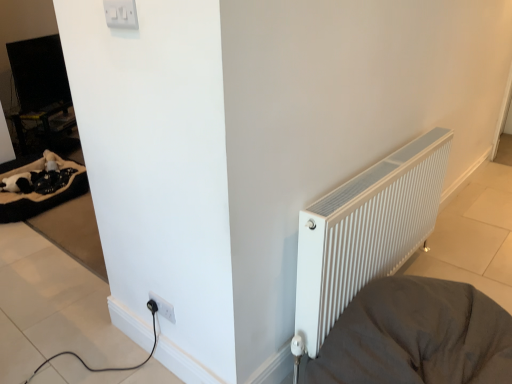
Question: From the image's perspective, is wooden table at left beneath white ribbed radiator at right?

Choices:
 (A) no
 (B) yes

Answer: (A)

Question: Could white ribbed radiator at right be considered to be inside wooden table at left?

Choices:
 (A) yes
 (B) no

Answer: (B)

Question: Is wooden table at left bigger than white ribbed radiator at right?

Choices:
 (A) no
 (B) yes

Answer: (A)

Question: Can you confirm if wooden table at left is wider than white ribbed radiator at right?

Choices:
 (A) yes
 (B) no

Answer: (A)

Question: Is wooden table at left aimed at white ribbed radiator at right?

Choices:
 (A) yes
 (B) no

Answer: (A)

Question: Is white ribbed radiator at right situated inside white ribbed radiator at right or outside?

Choices:
 (A) outside
 (B) inside

Answer: (A)

Question: In terms of width, does white ribbed radiator at right look wider or thinner when compared to white ribbed radiator at right?

Choices:
 (A) wide
 (B) thin

Answer: (A)

Question: Is point (410, 329) positioned closer to the camera than point (305, 235)?

Choices:
 (A) farther
 (B) closer

Answer: (A)

Question: In terms of size, does white ribbed radiator at right appear bigger or smaller than white ribbed radiator at right?

Choices:
 (A) big
 (B) small

Answer: (A)

Question: Considering their positions, is soft beige fabric at left located in front of or behind white ribbed radiator at right?

Choices:
 (A) front
 (B) behind

Answer: (B)

Question: From the image's perspective, is soft beige fabric at left located above or below white ribbed radiator at right?

Choices:
 (A) above
 (B) below

Answer: (A)

Question: Considering the relative positions of soft beige fabric at left and white ribbed radiator at right in the image provided, is soft beige fabric at left to the left or to the right of white ribbed radiator at right?

Choices:
 (A) left
 (B) right

Answer: (A)

Question: In terms of size, does soft beige fabric at left appear bigger or smaller than white ribbed radiator at right?

Choices:
 (A) small
 (B) big

Answer: (A)

Question: Is point (35, 208) positioned closer to the camera than point (39, 114)?

Choices:
 (A) farther
 (B) closer

Answer: (B)

Question: Is soft beige fabric at left in front of or behind wooden table at left in the image?

Choices:
 (A) behind
 (B) front

Answer: (B)